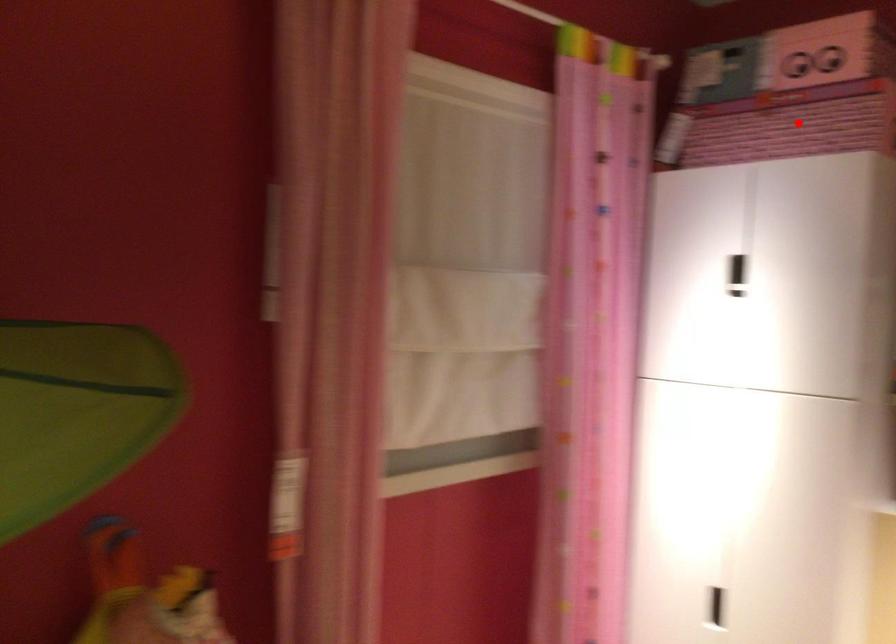
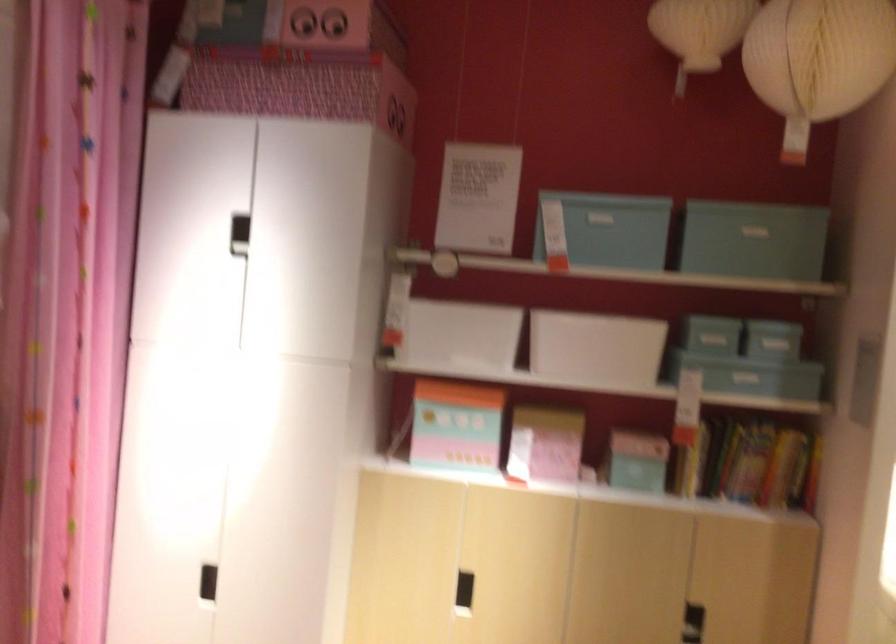
Where in the second image is the point corresponding to the highlighted location from the first image?

(300, 87)